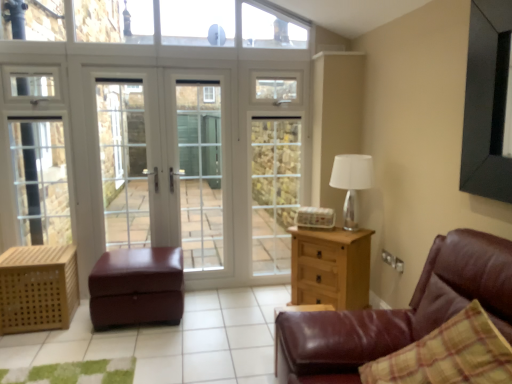
Image resolution: width=512 pixels, height=384 pixels. Identify the location of space that is in front of leather ottoman at center. pos(114,349).